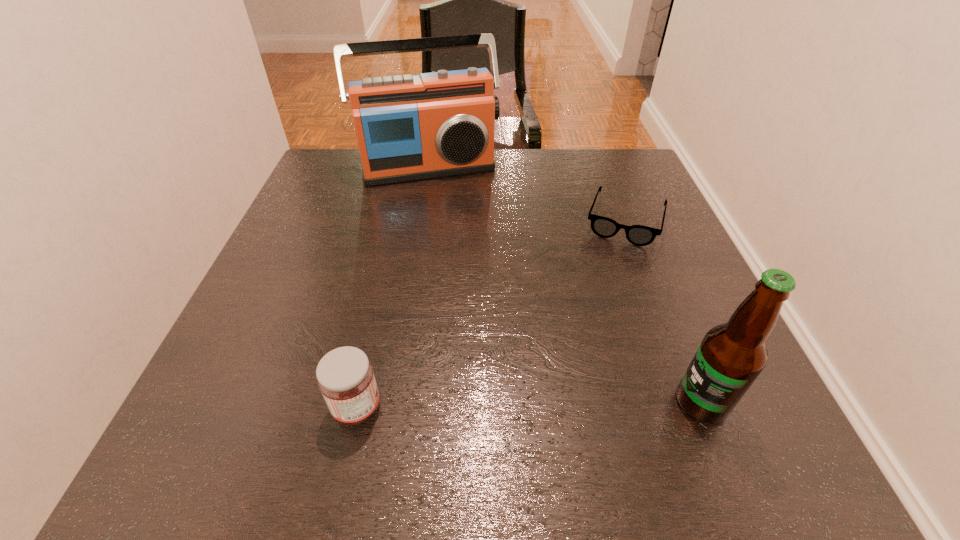
Identify which object is located as the third nearest to the radio receiver. Please provide its 2D coordinates. Your answer should be formatted as a tuple, i.e. [(x, y)], where the tuple contains the x and y coordinates of a point satisfying the conditions above.

[(731, 356)]

Identify the location of object that is the second nearest to the radio receiver. This screenshot has height=540, width=960. (345, 376).

At what (x,y) coordinates should I click in order to perform the action: click on free space that satisfies the following two spatial constraints: 1. on the front side of the radio receiver; 2. on the label of the second tallest object. Please return your answer as a coordinate pair (x, y). This screenshot has width=960, height=540. Looking at the image, I should click on (390, 403).

Locate an element on the screen. The height and width of the screenshot is (540, 960). blank space that satisfies the following two spatial constraints: 1. on the front side of the shortest object; 2. on the label of the third shortest object is located at coordinates (696, 403).

Where is `vacant point that satisfies the following two spatial constraints: 1. on the front side of the third shortest object; 2. on the label of the farthest object`? vacant point that satisfies the following two spatial constraints: 1. on the front side of the third shortest object; 2. on the label of the farthest object is located at coordinates (390, 403).

The width and height of the screenshot is (960, 540). I want to click on free space that satisfies the following two spatial constraints: 1. on the back side of the jam; 2. on the label of the beer bottle, so click(358, 403).

Find the location of a particular element. The width and height of the screenshot is (960, 540). vacant space that satisfies the following two spatial constraints: 1. on the back side of the jam; 2. on the label of the beer bottle is located at coordinates (358, 403).